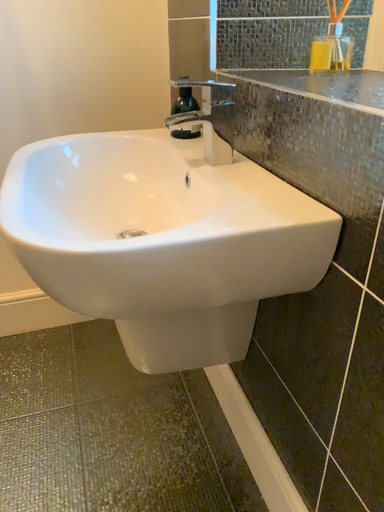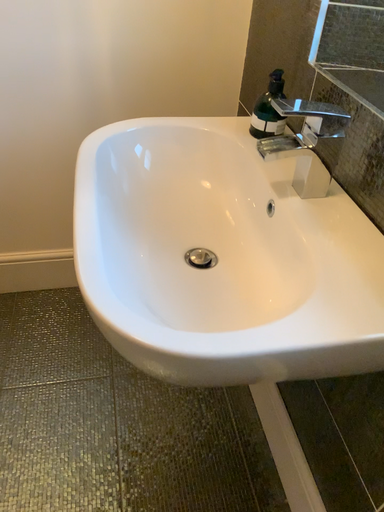
Question: How did the camera likely rotate when shooting the video?

Choices:
 (A) rotated upward
 (B) rotated downward

Answer: (B)